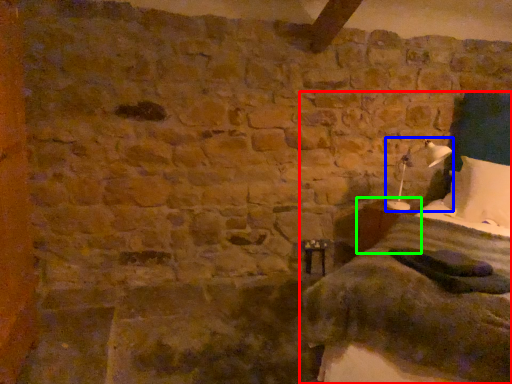
Question: Which object is positioned farthest from bed (highlighted by a red box)? Select from bedside lamp (highlighted by a blue box) and table (highlighted by a green box).

Choices:
 (A) bedside lamp
 (B) table

Answer: (A)